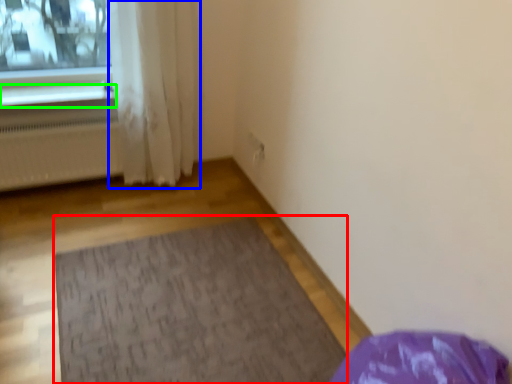
Question: Which is farther away from mat (highlighted by a red box)? curtain (highlighted by a blue box) or window sill (highlighted by a green box)?

Choices:
 (A) curtain
 (B) window sill

Answer: (B)